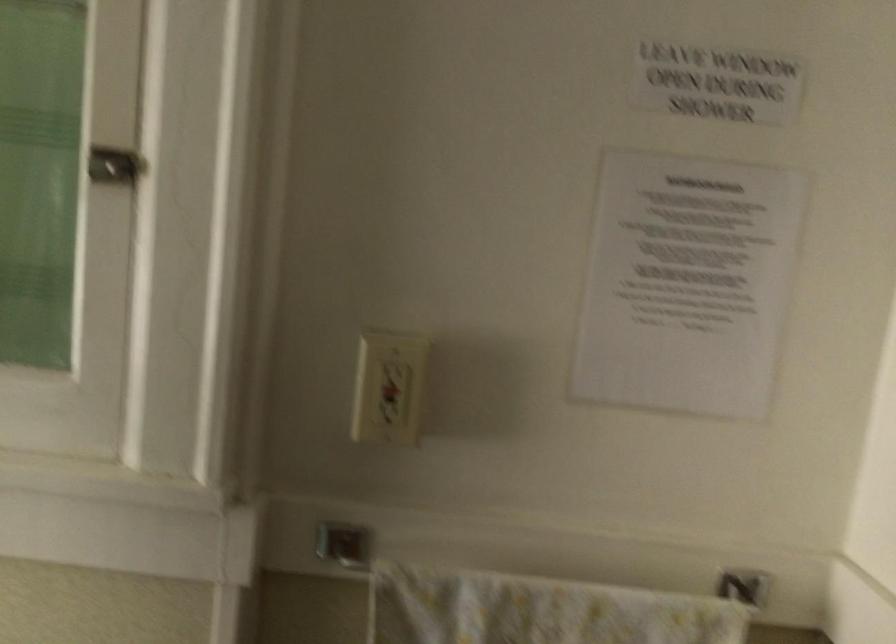
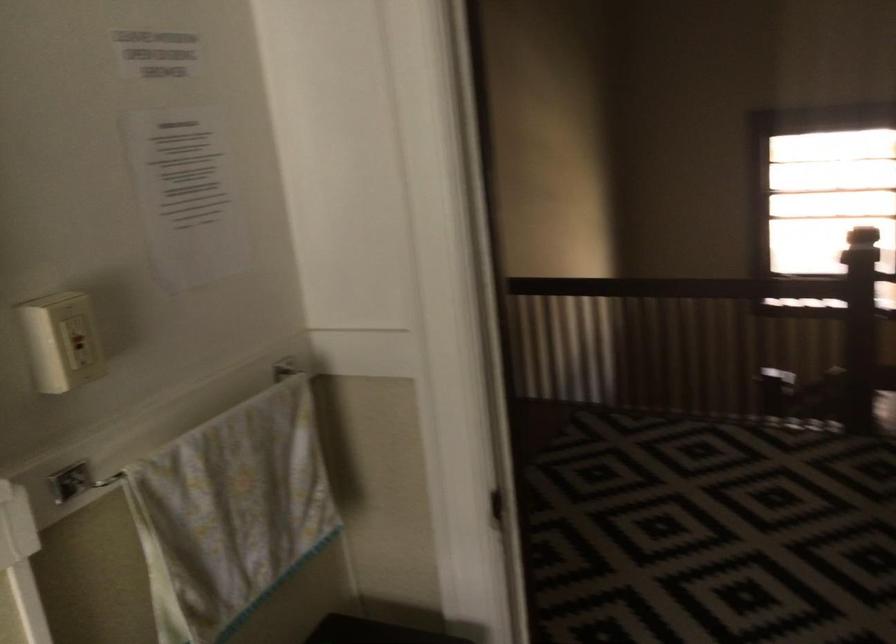
Consider the image. How did the camera likely rotate?

The camera's rotation is toward right-down.